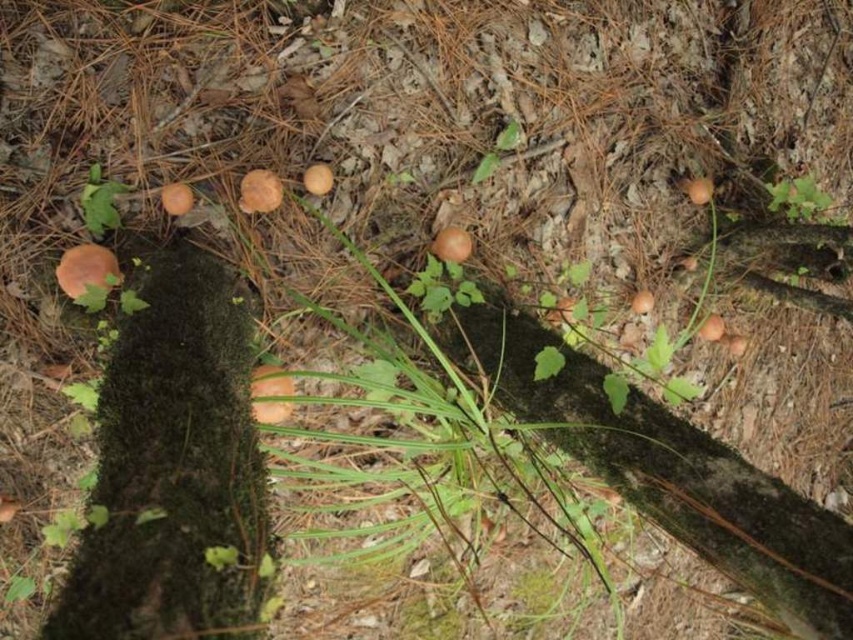
Question: Does green mossy tree trunk at left have a greater width compared to brown matte mushroom at center?

Choices:
 (A) yes
 (B) no

Answer: (A)

Question: Is green mossy tree trunk at left closer to camera compared to brown matte mushroom at center?

Choices:
 (A) yes
 (B) no

Answer: (A)

Question: Is green mossy tree trunk at left below brown matte mushroom at center?

Choices:
 (A) yes
 (B) no

Answer: (A)

Question: Among these objects, which one is farthest from the camera?

Choices:
 (A) brown matte mushroom at center
 (B) green mossy tree trunk at left

Answer: (A)

Question: Which point is farther to the camera?

Choices:
 (A) green mossy tree trunk at left
 (B) brown matte mushroom at center

Answer: (B)